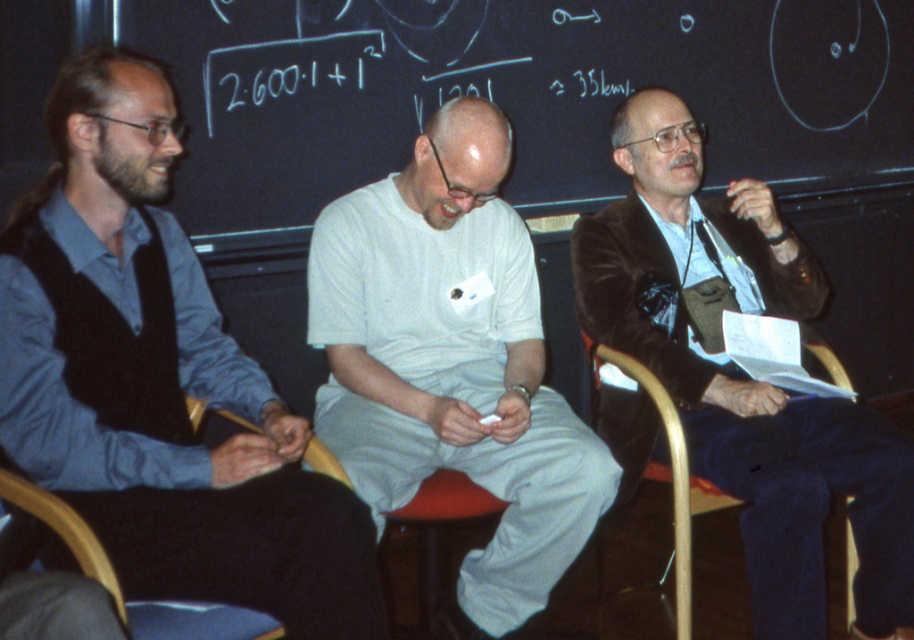
Is point (474, 292) in front of point (591, 349)?

Yes, point (474, 292) is closer to viewer.

Which is in front, point (598, 497) or point (628, 369)?

Point (598, 497) is more forward.

Is point (339, 228) farther from camera compared to point (639, 365)?

No.

This screenshot has height=640, width=914. In order to click on white cotton shirt at center in this screenshot , I will do `click(452, 364)`.

Who is more forward, (304, 72) or (833, 355)?

Positioned in front is point (304, 72).

Can you confirm if black chalkboard at upper center is positioned below wooden chair at lower right?

No, black chalkboard at upper center is not below wooden chair at lower right.

Image resolution: width=914 pixels, height=640 pixels. What do you see at coordinates (515, 90) in the screenshot?
I see `black chalkboard at upper center` at bounding box center [515, 90].

This screenshot has width=914, height=640. In order to click on black chalkboard at upper center in this screenshot , I will do `click(515, 90)`.

Does matte black vest at left have a lesser width compared to white cotton shirt at center?

Yes, matte black vest at left is thinner than white cotton shirt at center.

Who is positioned more to the left, matte black vest at left or white cotton shirt at center?

matte black vest at left

Who is more distant from viewer, (92,132) or (369,337)?

Positioned behind is point (369,337).

I want to click on matte black vest at left, so click(x=158, y=380).